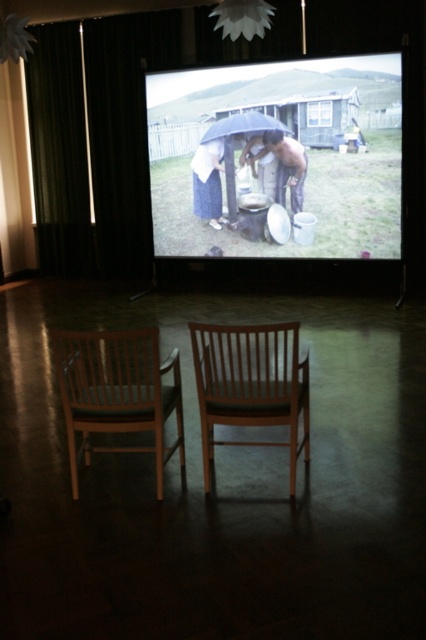
You are a costume designer reviewing a film scene. You need to determine if the matte blue dress at center can be worn over the smooth beige fabric umbrella at center. Based on their sizes, is this feasible?

The matte blue dress at center is larger than the smooth beige fabric umbrella at center, so it is possible to wear the matte blue dress at center over the smooth beige fabric umbrella at center.

You are a movie director analyzing the scene shown on the screen. You need to ensure that the matte black umbrella at center and the matte blue dress at center are framed properly. Based on their sizes, which object should be placed closer to the camera to maintain proportional balance?

The matte black umbrella at center is wider than the matte blue dress at center. To maintain proportional balance, the smaller matte blue dress at center should be placed closer to the camera so that both objects appear similar in size in the frame.